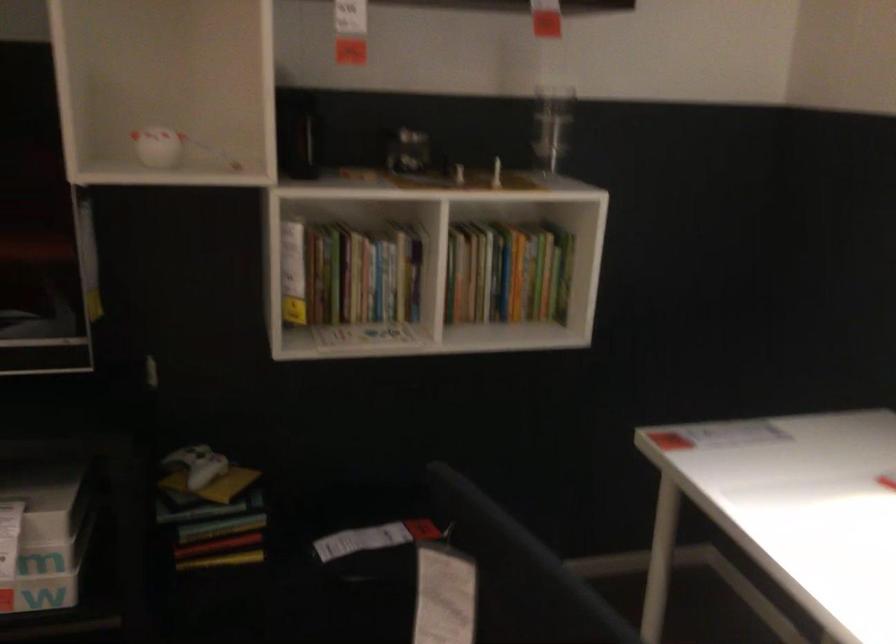
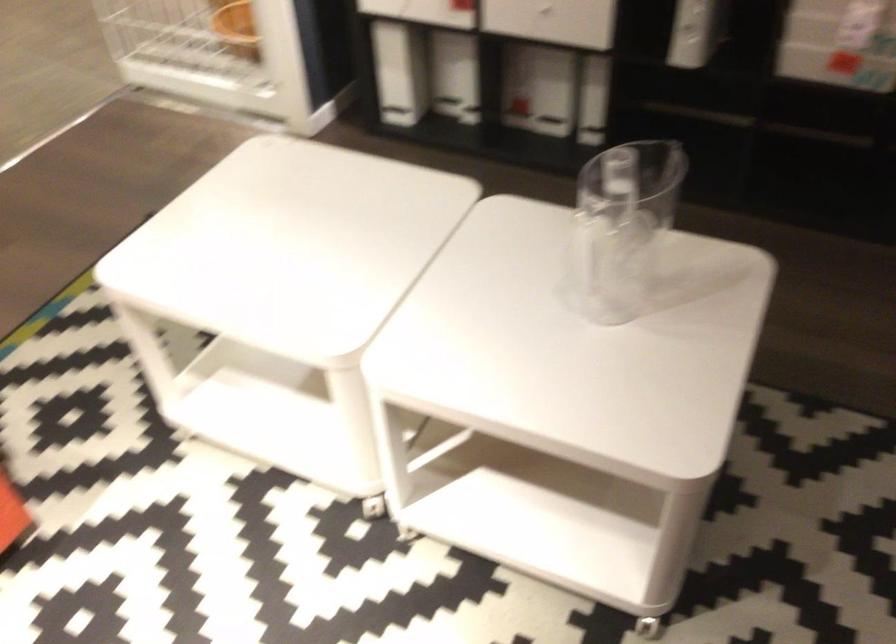
Based on the continuous images, in which direction is the camera rotating?

The camera's rotation is toward left-down.